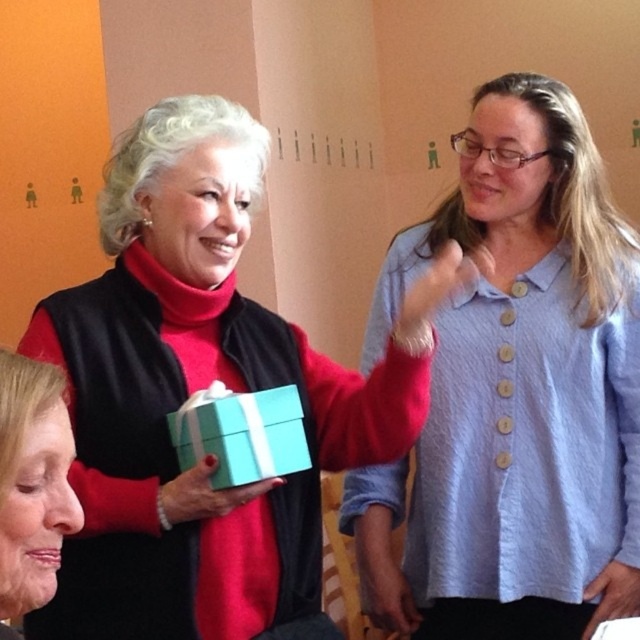
Question: Which point appears farthest from the camera in this image?

Choices:
 (A) (276, 408)
 (B) (36, 385)
 (C) (166, 134)
 (D) (536, 440)

Answer: (D)

Question: Does blue textured shirt at upper right have a lesser width compared to smooth beige face at lower left?

Choices:
 (A) yes
 (B) no

Answer: (B)

Question: Where is smooth beige face at lower left located in relation to tiffany blue paper at center in the image?

Choices:
 (A) right
 (B) left

Answer: (B)

Question: Which of these objects is positioned closest to the blue textured shirt at upper right?

Choices:
 (A) smooth beige face at lower left
 (B) tiffany blue paper at center

Answer: (B)

Question: Based on their relative distances, which object is nearer to the blue textured shirt at upper right?

Choices:
 (A) tiffany blue paper at center
 (B) smooth beige face at lower left
 (C) matte blue box at center

Answer: (C)

Question: Does matte blue box at center appear on the right side of smooth beige face at lower left?

Choices:
 (A) yes
 (B) no

Answer: (A)